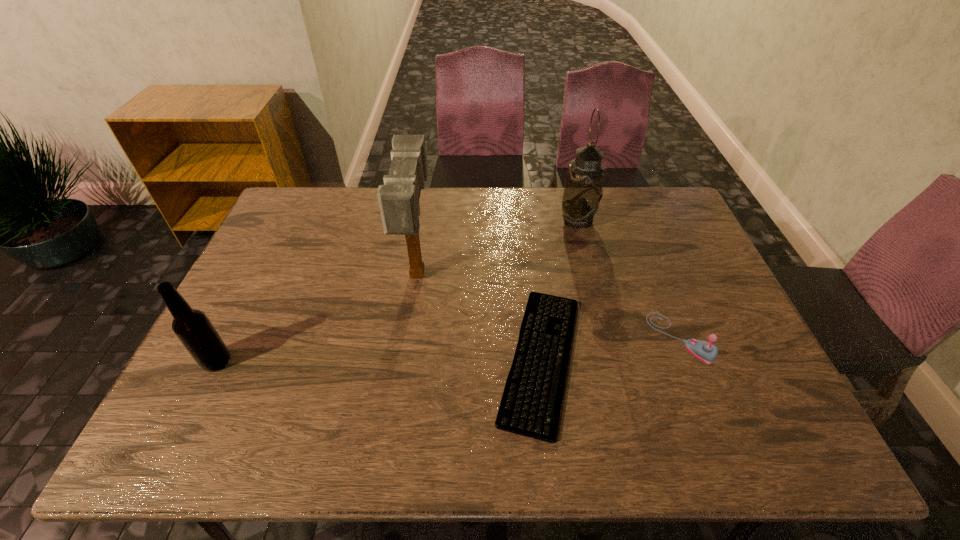
At what (x,y) coordinates should I click in order to perform the action: click on vacant position in the image that satisfies the following two spatial constraints: 1. on the back side of the shortest object; 2. on the right side of the fourth tallest object. Please return your answer as a coordinate pair (x, y). The height and width of the screenshot is (540, 960). Looking at the image, I should click on (539, 338).

You are a GUI agent. You are given a task and a screenshot of the screen. Output one action in this format:
    pyautogui.click(x=<x>, y=<y>)
    Task: Click on the vacant area in the image that satisfies the following two spatial constraints: 1. on the back side of the leftmost object; 2. on the right side of the rightmost object
    The image size is (960, 540).
    Given the screenshot: What is the action you would take?
    point(228,338)

Find the location of a particular element. free space in the image that satisfies the following two spatial constraints: 1. on the front side of the joystick; 2. on the right side of the oil lamp is located at coordinates (608, 338).

The height and width of the screenshot is (540, 960). In order to click on free space that satisfies the following two spatial constraints: 1. on the back side of the beer bottle; 2. on the right side of the joystick in this screenshot , I will do `click(228, 338)`.